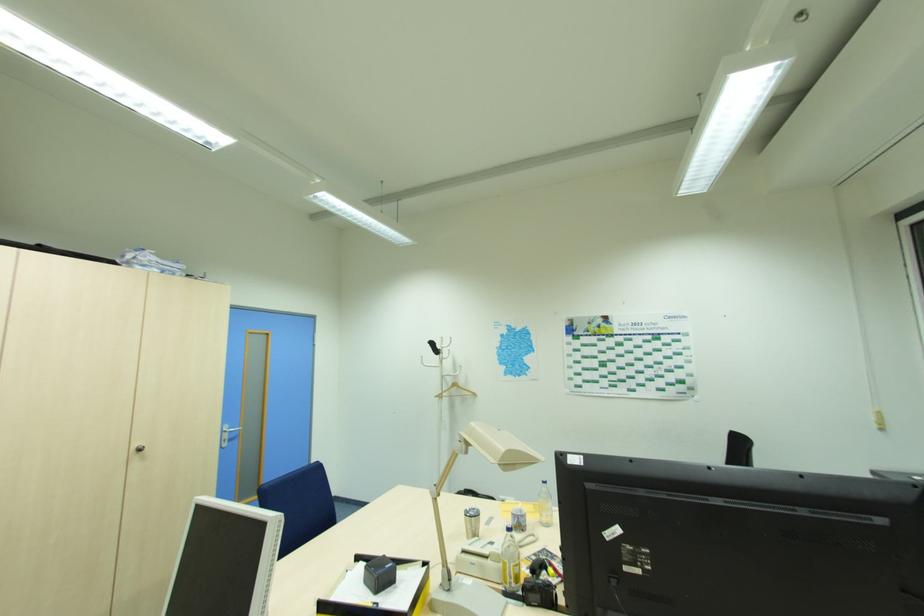
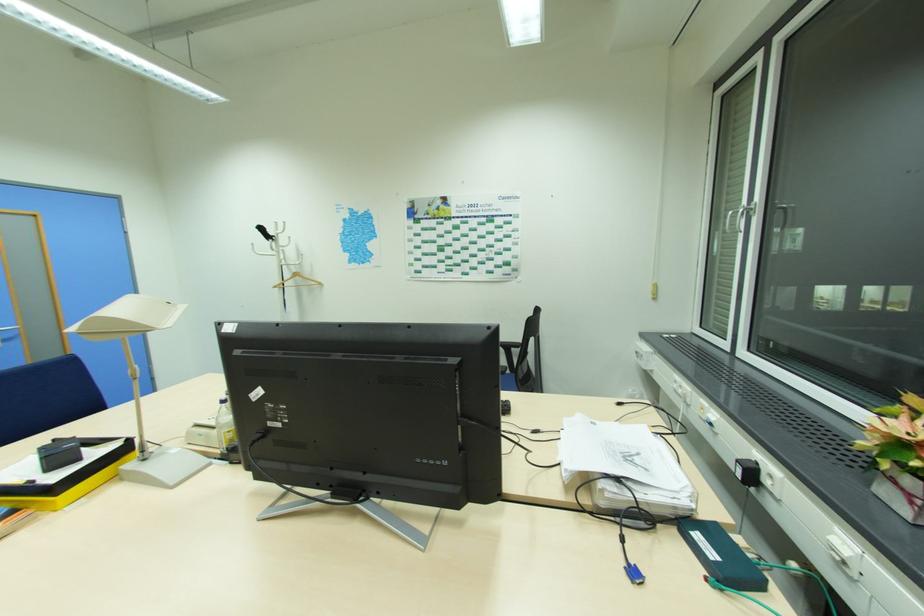
Question: In a continuous first-person perspective shot, in which direction is the camera moving?

Choices:
 (A) Left
 (B) Right
 (C) Forward
 (D) Backward

Answer: (B)